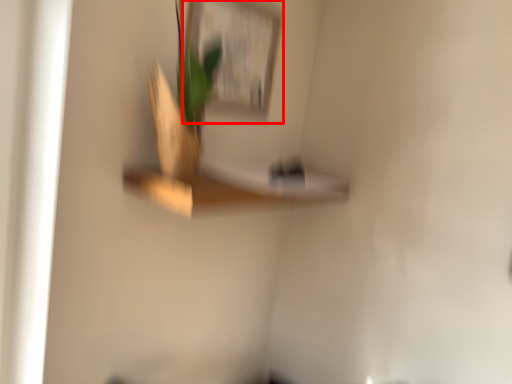
Question: From the image's perspective, where is picture frame (annotated by the red box) located relative to shelf?

Choices:
 (A) above
 (B) below

Answer: (A)